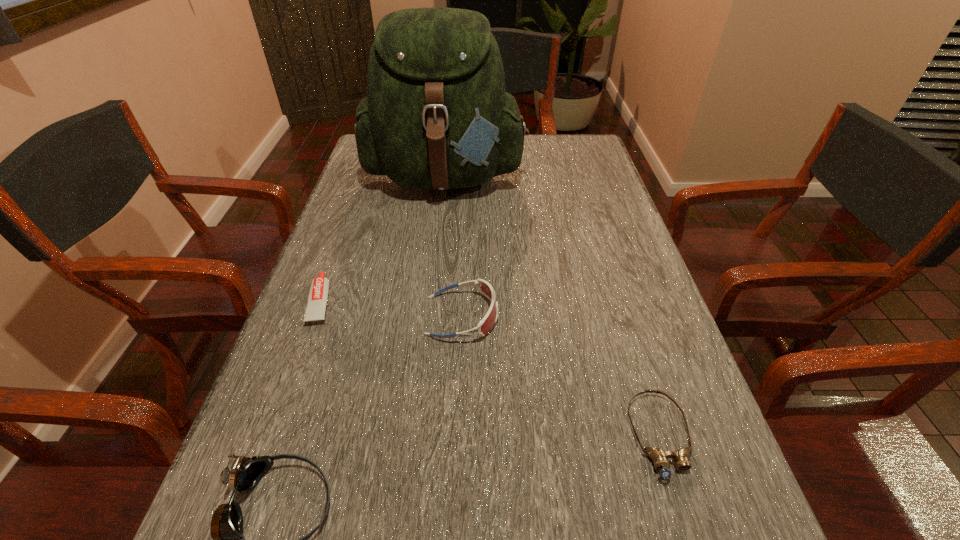
You are a GUI agent. You are given a task and a screenshot of the screen. Output one action in this format:
    pyautogui.click(x=<x>, y=<y>)
    Task: Click on the object positioned at the far edge
    This screenshot has height=540, width=960.
    Given the screenshot: What is the action you would take?
    pyautogui.click(x=436, y=116)

Where is `backpack present at the left edge`? The width and height of the screenshot is (960, 540). backpack present at the left edge is located at coordinates (436, 116).

At what (x,y) coordinates should I click in order to perform the action: click on toothpaste that is at the left edge. Please return your answer as a coordinate pair (x, y). This screenshot has height=540, width=960. Looking at the image, I should click on (318, 294).

The width and height of the screenshot is (960, 540). I want to click on object that is at the right edge, so click(x=659, y=457).

Where is `object that is at the far left corner`? object that is at the far left corner is located at coordinates (436, 116).

In the image, there is a desktop. In order to click on vacant space at the left edge in this screenshot , I will do `click(369, 184)`.

The image size is (960, 540). In the image, there is a desktop. In order to click on vacant region at the right edge in this screenshot , I will do `click(598, 224)`.

The width and height of the screenshot is (960, 540). In the image, there is a desktop. What are the coordinates of `vacant space at the far right corner` in the screenshot? It's located at (594, 143).

At what (x,y) coordinates should I click in order to perform the action: click on vacant region between the toothpaste and the tallest object. Please return your answer as a coordinate pair (x, y). The image size is (960, 540). Looking at the image, I should click on (383, 239).

Image resolution: width=960 pixels, height=540 pixels. In order to click on vacant space in between the second goggles from left to right and the shortest goggles in this screenshot , I will do `click(561, 376)`.